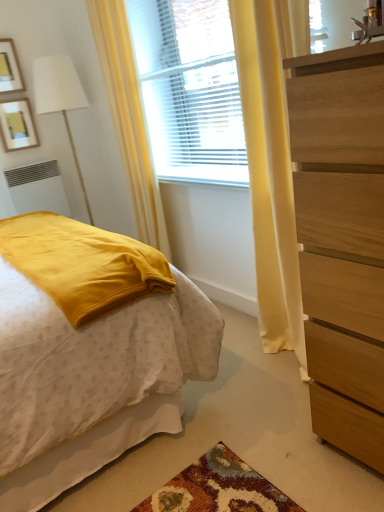
What are the coordinates of `blank space above white matte radiator at lower left (from a real-world perspective)` in the screenshot? It's located at (28, 161).